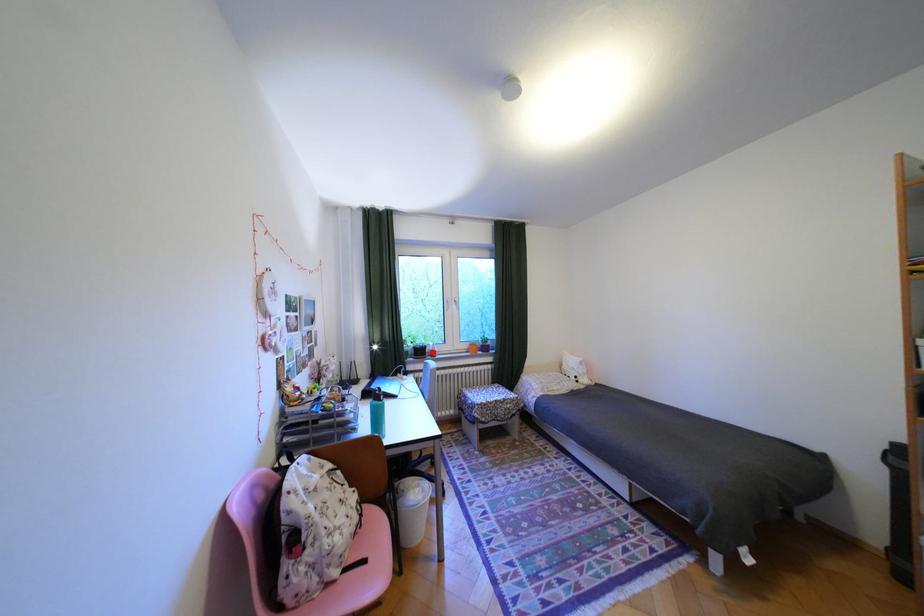
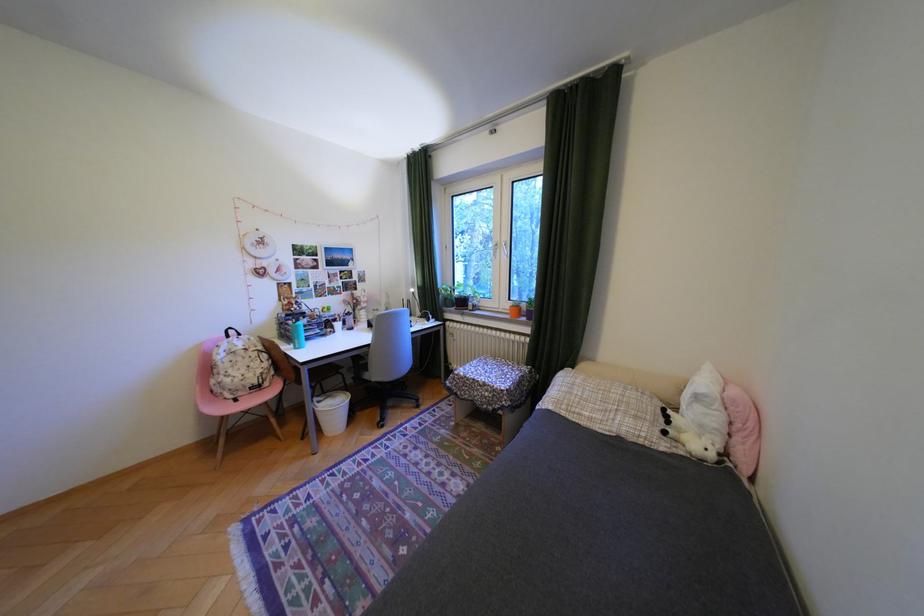
In the second image, find the point that corresponds to the highlighted location in the first image.

(475, 302)